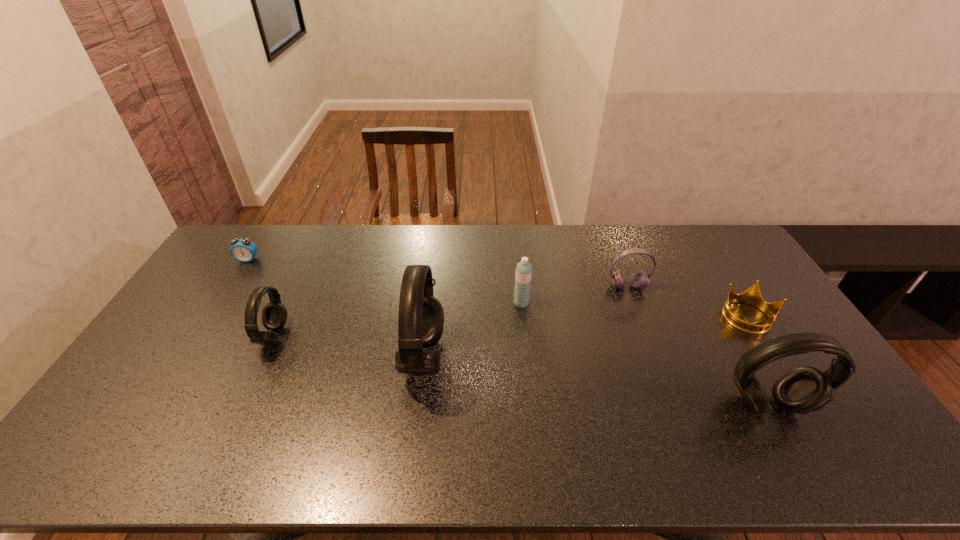
The height and width of the screenshot is (540, 960). I want to click on the sixth closest object relative to the second object from left to right, so click(752, 296).

What are the coordinates of `headset that stands as the third closest to the farthest object` in the screenshot? It's located at (640, 279).

Image resolution: width=960 pixels, height=540 pixels. I want to click on headset that can be found as the third closest to the leftmost object, so click(640, 279).

Locate an element on the screen. Image resolution: width=960 pixels, height=540 pixels. free space that satisfies the following two spatial constraints: 1. on the headband and ear cups of the second farthest object; 2. on the earcups of the second object from left to right is located at coordinates (645, 336).

The height and width of the screenshot is (540, 960). I want to click on free location that satisfies the following two spatial constraints: 1. on the headband and ear cups of the crown; 2. on the right side of the farthest headset, so click(639, 318).